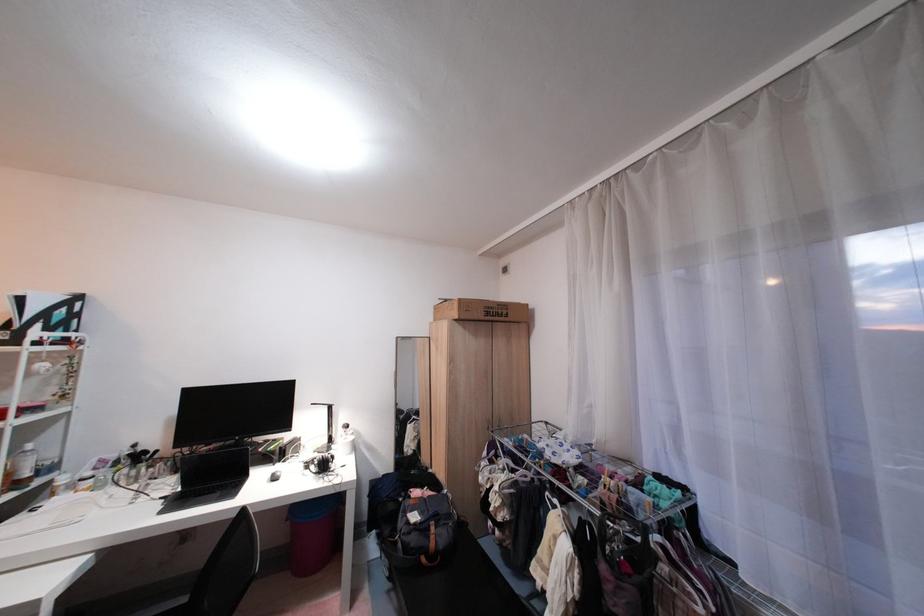
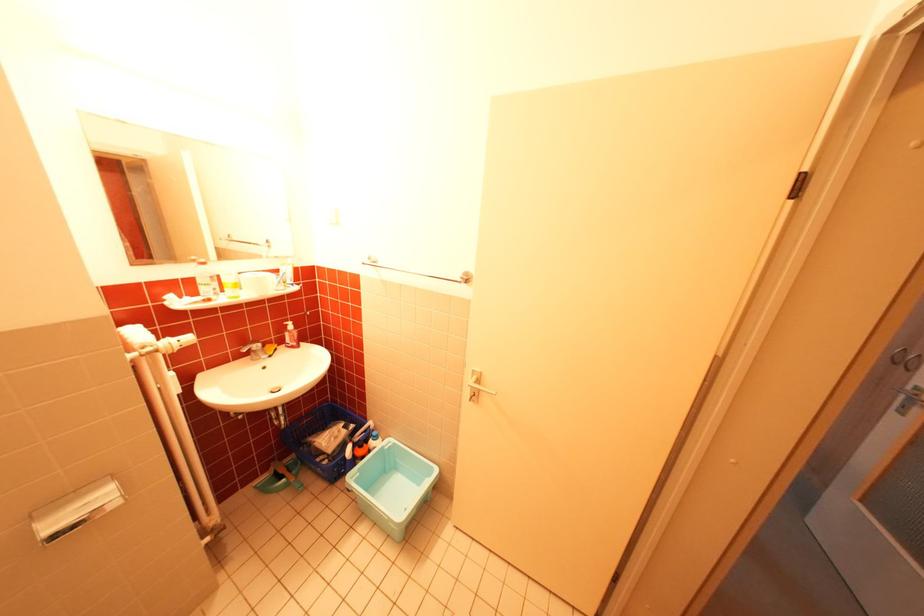
Question: I am providing you with two images of the same scene from different viewpoints. After the viewpoint changes to image2, which objects are now occluded?

Choices:
 (A) magenta trash can
 (B) metal wall flap
 (C) yellow ping-pong ball
 (D) dispenser pump top

Answer: (A)